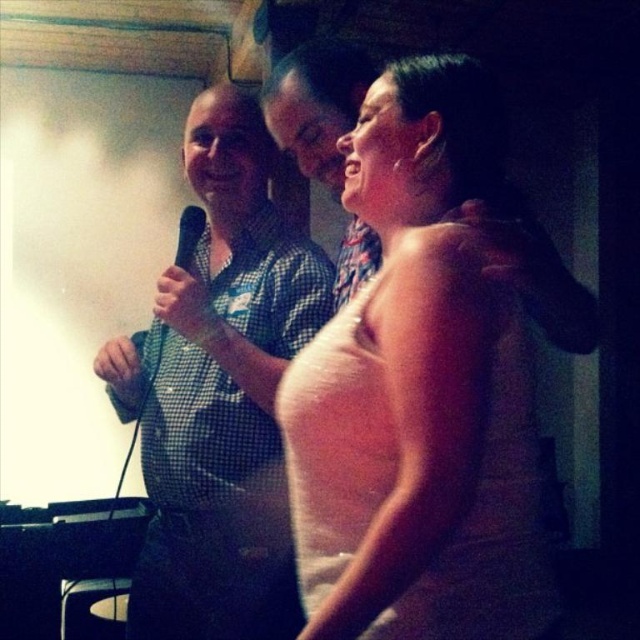
You are a photographer in the room and want to take a photo of the black matte microphone at center and the pink satin dress at center. Which object should you focus on first if you want to capture both in one shot without moving the camera?

The black matte microphone at center is above the pink satin dress at center, so you should focus on the black matte microphone at center first to ensure both are in focus since it is closer to the camera.

In the karaoke scene, you notice the pink satin dress at center and the checkered fabric shirt at left. Which one is positioned more to the right side of the image?

The pink satin dress at center is positioned to the right of the checkered fabric shirt at left, so the pink satin dress at center is more to the right side of the image.

From the picture: You are a photographer in the room and want to take a photo of the black matte microphone at center and the pink satin dress at center. From the photographer perspective, which object is on the right side?

The pink satin dress at center is to the right of the black matte microphone at center, so from the photographer perspective, the pink satin dress at center is on the right side.